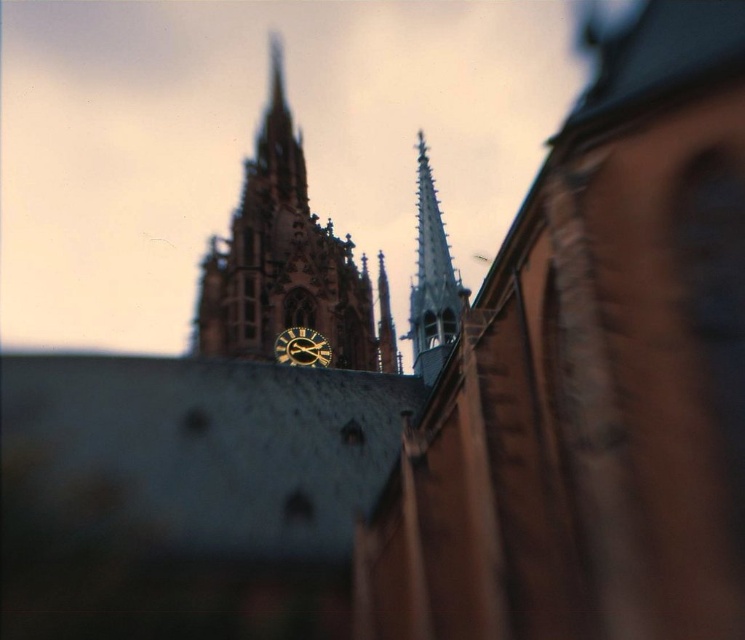
You are standing in front of the Gothic church and looking at its clock tower. You notice two points marked on the tower. The first point is at coordinates point (352,333), and the second is at point (308,353). Which of these points is closer to you?

Point (352,333) is closer to you because it is further to the viewer than point (308,353).

You are standing in front of the Gothic church and want to take a photo. There are two points marked in the image at coordinates point (253, 176) and point (443, 324). Which point should you focus on to ensure the church clock face is sharp in your photo?

You should focus on point (443, 324) because point (253, 176) is behind it, and the clock face is likely closer to the foreground point.